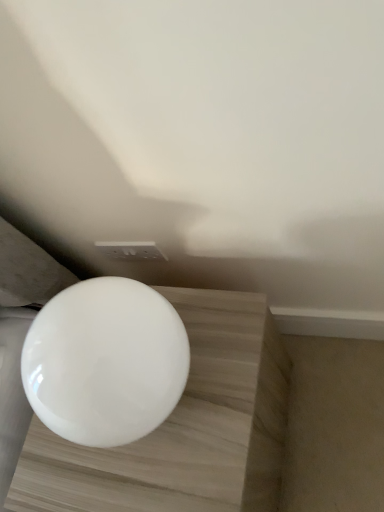
Question: Is white glossy sphere at center taller than white glossy toilet at center?

Choices:
 (A) no
 (B) yes

Answer: (B)

Question: Is white glossy sphere at center wider than white glossy toilet at center?

Choices:
 (A) no
 (B) yes

Answer: (B)

Question: Can you confirm if white glossy sphere at center is thinner than white glossy toilet at center?

Choices:
 (A) yes
 (B) no

Answer: (B)

Question: Would you say white glossy toilet at center is part of white glossy sphere at center's contents?

Choices:
 (A) yes
 (B) no

Answer: (B)

Question: Considering the relative positions of white glossy sphere at center and white glossy toilet at center in the image provided, is white glossy sphere at center behind white glossy toilet at center?

Choices:
 (A) yes
 (B) no

Answer: (A)

Question: From a real-world perspective, is white glossy sphere at center physically below white glossy toilet at center?

Choices:
 (A) yes
 (B) no

Answer: (A)

Question: Does white glossy toilet at center appear on the right side of white glossy sphere at center?

Choices:
 (A) no
 (B) yes

Answer: (A)

Question: Is white glossy toilet at center far away from white glossy sphere at center?

Choices:
 (A) yes
 (B) no

Answer: (B)

Question: Considering the relative sizes of white glossy toilet at center and white glossy sphere at center in the image provided, is white glossy toilet at center thinner than white glossy sphere at center?

Choices:
 (A) no
 (B) yes

Answer: (B)

Question: Is white glossy toilet at center placed right next to white glossy sphere at center?

Choices:
 (A) yes
 (B) no

Answer: (B)

Question: Does white glossy toilet at center turn towards white glossy sphere at center?

Choices:
 (A) no
 (B) yes

Answer: (A)

Question: Would you say white glossy sphere at center is part of white glossy toilet at center's contents?

Choices:
 (A) no
 (B) yes

Answer: (A)

Question: In terms of width, does white glossy toilet at center look wider or thinner when compared to white glossy sphere at center?

Choices:
 (A) wide
 (B) thin

Answer: (B)